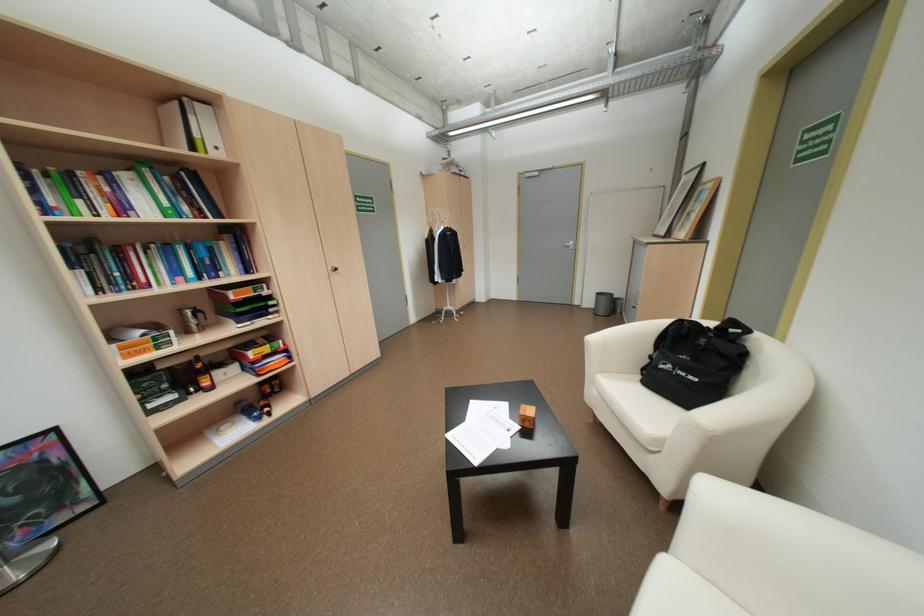
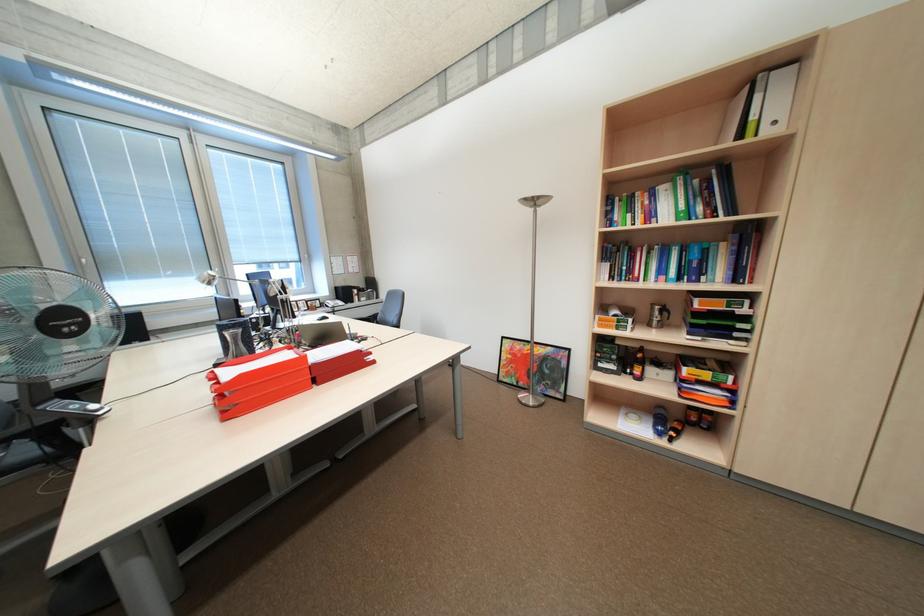
Find the pixel in the second image that matches (x=213, y=253) in the first image.

(704, 254)